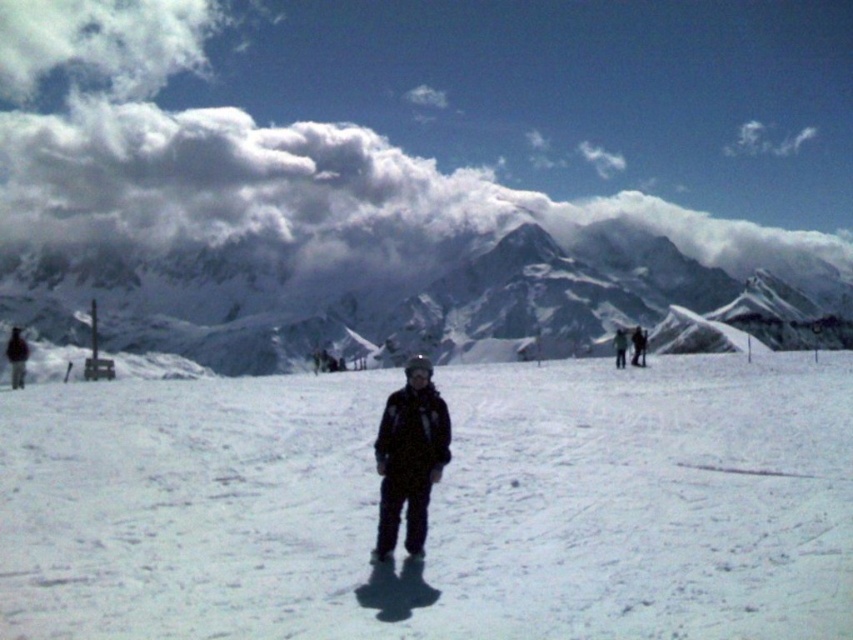
In the scene shown: You are standing at the point with coordinates point [302,288] and want to move towards the point [107,460]. Which direction should you go to get closer to your destination?

Since point [107,460] is closer to the viewer than point [302,288], you should move forward towards the direction of the destination point to get closer.